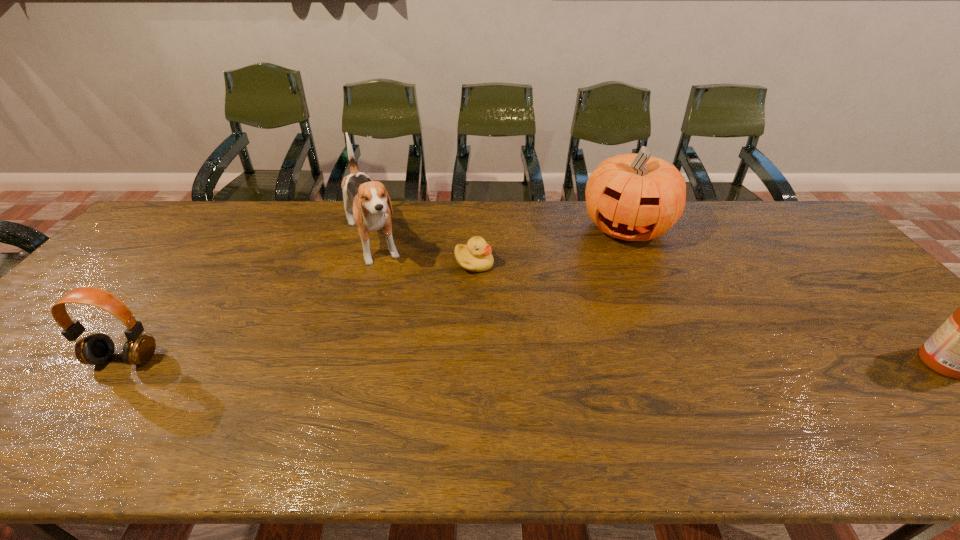
Identify which object is the nearest to the pumpkin. Please provide its 2D coordinates. Your answer should be formatted as a tuple, i.e. [(x, y)], where the tuple contains the x and y coordinates of a point satisfying the conditions above.

[(476, 256)]

Locate an element on the screen. object that stands as the fourth closest to the pumpkin is located at coordinates (97, 349).